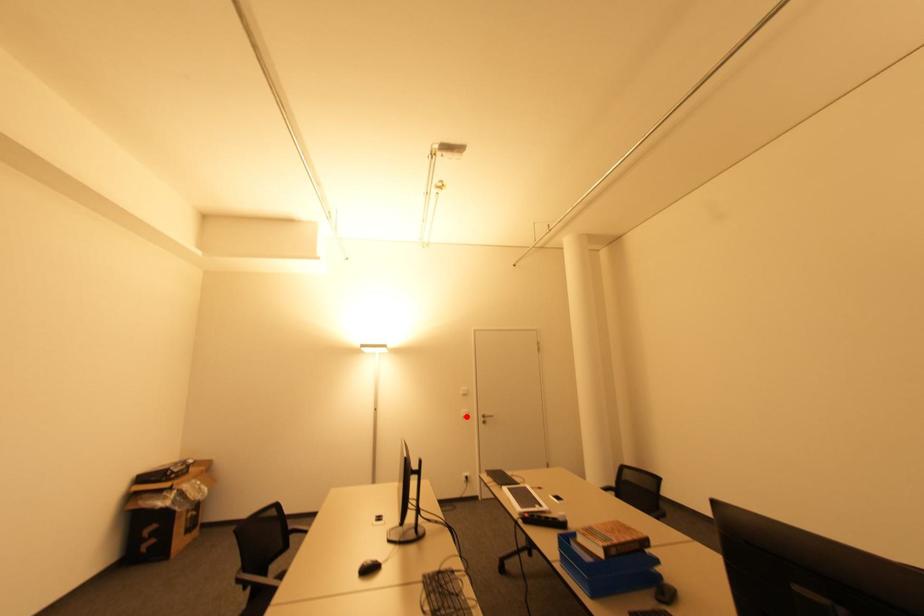
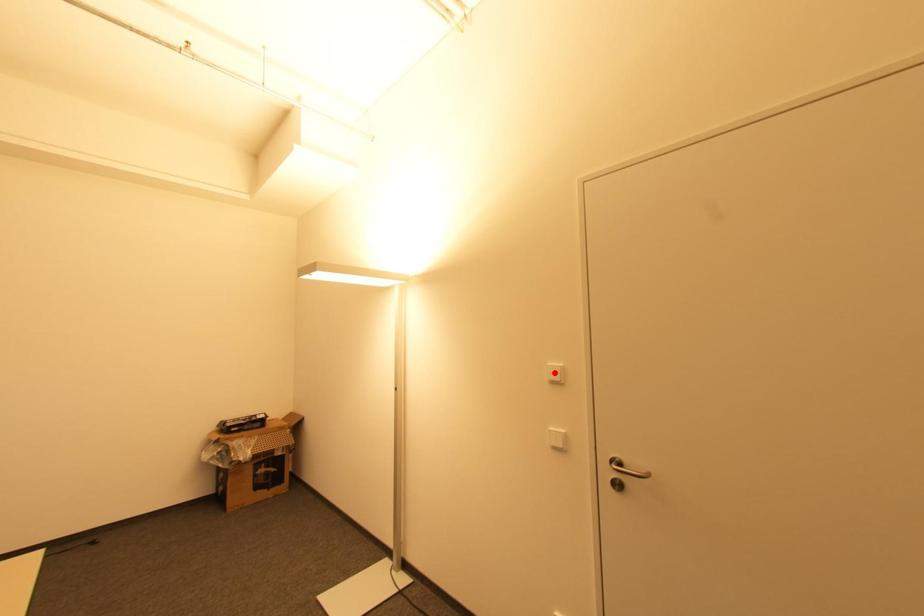
I am providing you with two images of the same scene from different viewpoints. A red point is marked on the first image and another point is marked on the second image. Is the red point in image1 aligned with the point shown in image2?

No